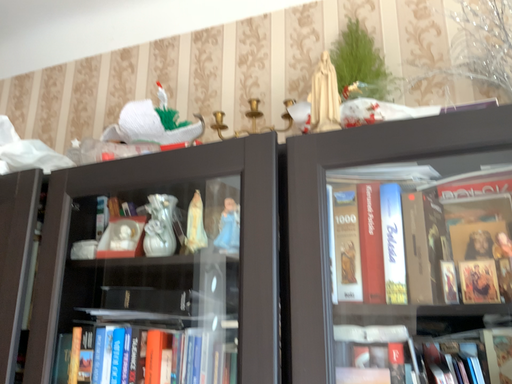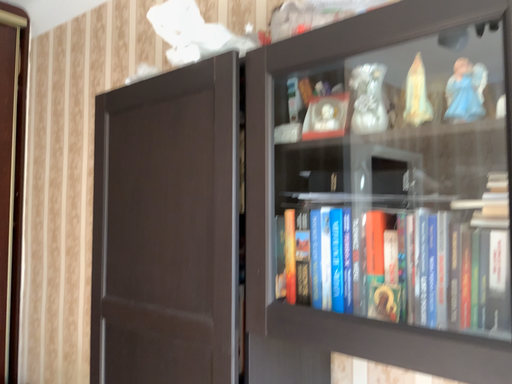
Question: How did the camera likely rotate when shooting the video?

Choices:
 (A) rotated right
 (B) rotated left

Answer: (B)